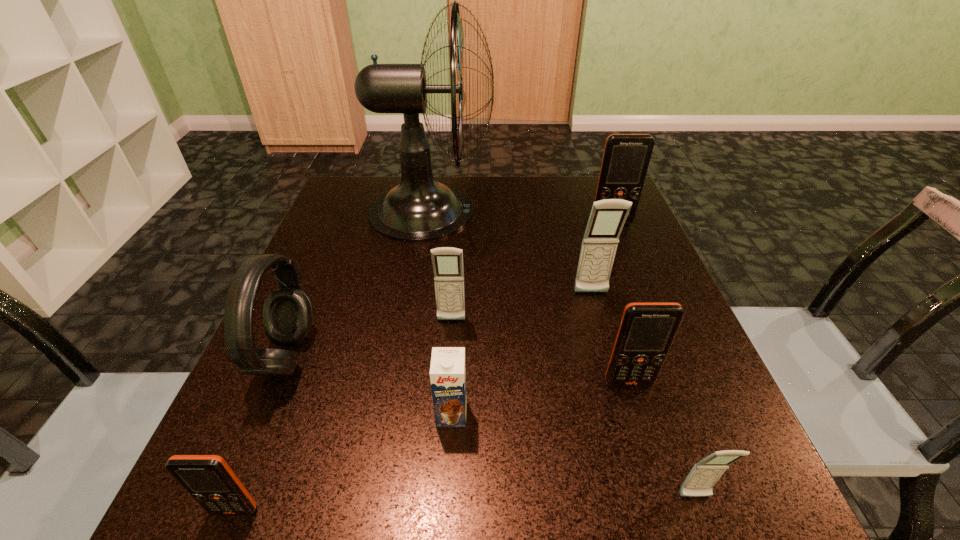
Identify the location of object located at the near right corner. This screenshot has height=540, width=960. (700, 481).

Locate an element on the screen. Image resolution: width=960 pixels, height=540 pixels. free space at the far edge is located at coordinates (560, 198).

Image resolution: width=960 pixels, height=540 pixels. I want to click on free spot at the near edge of the desktop, so click(x=412, y=503).

Locate an element on the screen. free location at the left edge of the desktop is located at coordinates (362, 285).

You are a GUI agent. You are given a task and a screenshot of the screen. Output one action in this format:
    pyautogui.click(x=<x>, y=<y>)
    Task: Click on the blank area at the right edge
    
    Given the screenshot: What is the action you would take?
    pyautogui.click(x=617, y=318)

Find the location of a particular element. vacant area at the far left corner of the desktop is located at coordinates (358, 218).

Identify the location of vacant space at the near left corner of the desktop. Image resolution: width=960 pixels, height=540 pixels. (224, 525).

I want to click on free space at the far right corner of the desktop, so click(567, 197).

What are the coordinates of `empty space between the chocolate milk and the smallest gray cellular telephone` in the screenshot? It's located at (573, 455).

The width and height of the screenshot is (960, 540). Find the location of `free space between the nearest gray cellular telephone and the gray headset`. free space between the nearest gray cellular telephone and the gray headset is located at coordinates (492, 427).